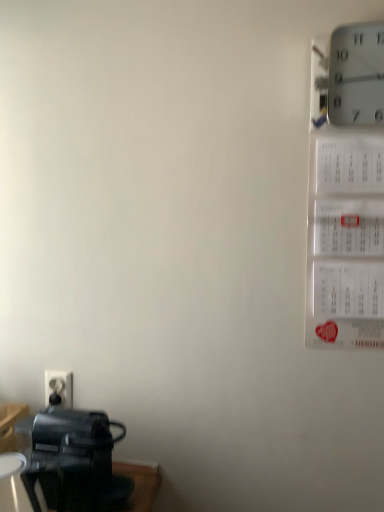
Question: Does white plastic electric outlet at lower left have a greater height compared to white plastic wall clock at upper right?

Choices:
 (A) yes
 (B) no

Answer: (B)

Question: Is white plastic electric outlet at lower left aimed at white plastic wall clock at upper right?

Choices:
 (A) yes
 (B) no

Answer: (B)

Question: Considering the relative sizes of white plastic electric outlet at lower left and white plastic wall clock at upper right in the image provided, is white plastic electric outlet at lower left thinner than white plastic wall clock at upper right?

Choices:
 (A) no
 (B) yes

Answer: (B)

Question: Considering the relative sizes of white plastic electric outlet at lower left and white plastic wall clock at upper right in the image provided, is white plastic electric outlet at lower left wider than white plastic wall clock at upper right?

Choices:
 (A) no
 (B) yes

Answer: (A)

Question: From the image's perspective, is white plastic electric outlet at lower left located above white plastic wall clock at upper right?

Choices:
 (A) no
 (B) yes

Answer: (A)

Question: From the image's perspective, is black plastic coffee maker at lower left positioned above or below white plastic electric outlet at lower left?

Choices:
 (A) above
 (B) below

Answer: (B)

Question: Is point (43, 479) positioned closer to the camera than point (67, 373)?

Choices:
 (A) closer
 (B) farther

Answer: (A)

Question: Considering the relative positions of black plastic coffee maker at lower left and white plastic electric outlet at lower left in the image provided, is black plastic coffee maker at lower left to the left or to the right of white plastic electric outlet at lower left?

Choices:
 (A) left
 (B) right

Answer: (B)

Question: Considering the positions of black plastic coffee maker at lower left and white plastic electric outlet at lower left in the image, is black plastic coffee maker at lower left taller or shorter than white plastic electric outlet at lower left?

Choices:
 (A) tall
 (B) short

Answer: (A)

Question: Looking at the image, does white plastic wall clock at upper right seem bigger or smaller compared to white plastic electric outlet at lower left?

Choices:
 (A) big
 (B) small

Answer: (A)

Question: Considering the positions of white plastic wall clock at upper right and white plastic electric outlet at lower left in the image, is white plastic wall clock at upper right taller or shorter than white plastic electric outlet at lower left?

Choices:
 (A) tall
 (B) short

Answer: (A)

Question: From a real-world perspective, relative to white plastic electric outlet at lower left, is white plastic wall clock at upper right vertically above or below?

Choices:
 (A) above
 (B) below

Answer: (A)

Question: Considering the positions of white plastic wall clock at upper right and white plastic electric outlet at lower left in the image, is white plastic wall clock at upper right wider or thinner than white plastic electric outlet at lower left?

Choices:
 (A) thin
 (B) wide

Answer: (B)

Question: From their relative heights in the image, would you say white plastic electric outlet at lower left is taller or shorter than white plastic wall clock at upper right?

Choices:
 (A) short
 (B) tall

Answer: (A)

Question: From the image's perspective, is white plastic electric outlet at lower left above or below white plastic wall clock at upper right?

Choices:
 (A) above
 (B) below

Answer: (B)